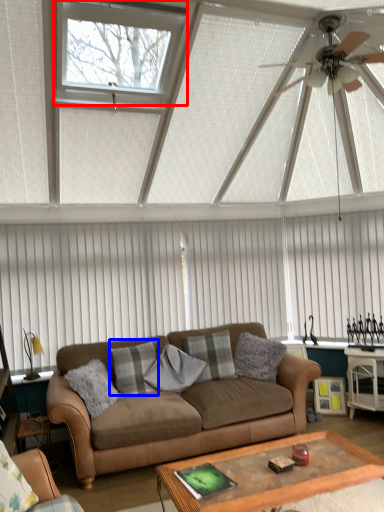
Question: Which object is further to the camera taking this photo, window (highlighted by a red box) or pillow (highlighted by a blue box)?

Choices:
 (A) window
 (B) pillow

Answer: (B)